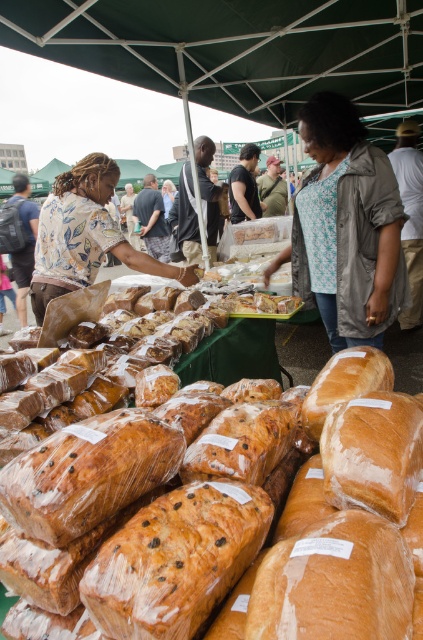
Is white cotton shirt at upper right below floral shirt at left?

Correct, white cotton shirt at upper right is located below floral shirt at left.

Who is taller, white cotton shirt at upper right or floral shirt at left?

floral shirt at left is taller.

This screenshot has width=423, height=640. I want to click on white cotton shirt at upper right, so click(x=411, y=214).

Can you confirm if floral-patterned shirt at center is positioned to the right of dark brown leather jacket at center?

Correct, you'll find floral-patterned shirt at center to the right of dark brown leather jacket at center.

Can you confirm if floral-patterned shirt at center is positioned below dark brown leather jacket at center?

Yes, floral-patterned shirt at center is below dark brown leather jacket at center.

Where is `floral-patterned shirt at center`? floral-patterned shirt at center is located at coordinates (346, 227).

Can you confirm if floral shirt at center is bigger than camouflage-patterned shirt at center?

Indeed, floral shirt at center has a larger size compared to camouflage-patterned shirt at center.

Is point (102, 193) behind point (274, 212)?

No, (102, 193) is in front of (274, 212).

Find the location of `floral shirt at center`. floral shirt at center is located at coordinates (85, 236).